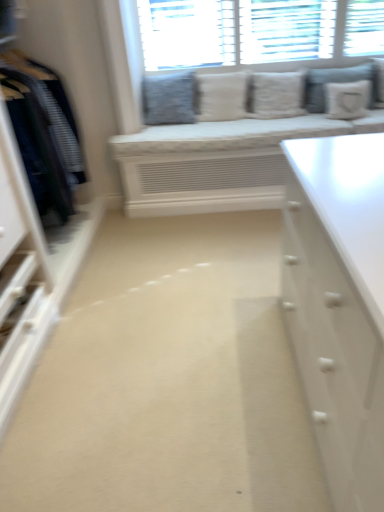
Question: Which direction should I rotate to look at white textured pillow at center, acting as the 3th pillow starting from the right, — up or down?

Choices:
 (A) down
 (B) up

Answer: (B)

Question: Does textured gray pillow at upper center, arranged as the fifth pillow when viewed from the right, turn towards white textured pillow at center, the second pillow from the left?

Choices:
 (A) no
 (B) yes

Answer: (A)

Question: Can you confirm if textured gray pillow at upper center, the first pillow when ordered from left to right, is shorter than white textured pillow at center, the second pillow from the left?

Choices:
 (A) yes
 (B) no

Answer: (B)

Question: Considering the relative sizes of textured gray pillow at upper center, the first pillow when ordered from left to right, and white textured pillow at center, which is counted as the 4th pillow, starting from the right, in the image provided, is textured gray pillow at upper center, the first pillow when ordered from left to right, smaller than white textured pillow at center, which is counted as the 4th pillow, starting from the right,?

Choices:
 (A) no
 (B) yes

Answer: (A)

Question: Is textured gray pillow at upper center, the first pillow when ordered from left to right, bigger than white textured pillow at center, which is counted as the 4th pillow, starting from the right?

Choices:
 (A) yes
 (B) no

Answer: (A)

Question: Is textured gray pillow at upper center, the first pillow when ordered from left to right, facing away from white textured pillow at center, which is counted as the 4th pillow, starting from the right?

Choices:
 (A) yes
 (B) no

Answer: (B)

Question: From a real-world perspective, is textured gray pillow at upper center, the first pillow when ordered from left to right, beneath white textured pillow at center, the second pillow from the left?

Choices:
 (A) yes
 (B) no

Answer: (B)

Question: Is white textured pillows at upper center not near white textured pillow at center, acting as the 3th pillow starting from the right?

Choices:
 (A) no
 (B) yes

Answer: (A)

Question: Does white textured pillows at upper center have a larger size compared to white textured pillow at center, which ranks as the third pillow in left-to-right order?

Choices:
 (A) no
 (B) yes

Answer: (B)

Question: Can white textured pillow at center, which ranks as the third pillow in left-to-right order, be found inside white textured pillows at upper center?

Choices:
 (A) yes
 (B) no

Answer: (B)

Question: Is white textured pillows at upper center to the left of white textured pillow at center, which ranks as the third pillow in left-to-right order, from the viewer's perspective?

Choices:
 (A) yes
 (B) no

Answer: (A)

Question: Does white textured pillows at upper center lie behind white textured pillow at center, which ranks as the third pillow in left-to-right order?

Choices:
 (A) yes
 (B) no

Answer: (B)

Question: Is white textured pillows at upper center smaller than white textured pillow at center, acting as the 3th pillow starting from the right?

Choices:
 (A) yes
 (B) no

Answer: (B)

Question: Considering the relative positions of white textured pillow at center, acting as the 3th pillow starting from the right, and white textured pillow at center, which is counted as the 4th pillow, starting from the right, in the image provided, is white textured pillow at center, acting as the 3th pillow starting from the right, to the left of white textured pillow at center, which is counted as the 4th pillow, starting from the right, from the viewer's perspective?

Choices:
 (A) yes
 (B) no

Answer: (B)